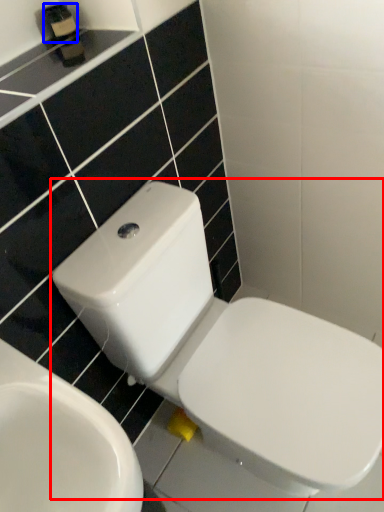
Question: Among these objects, which one is farthest to the camera, toilet (highlighted by a red box) or toiletry (highlighted by a blue box)?

Choices:
 (A) toilet
 (B) toiletry

Answer: (B)